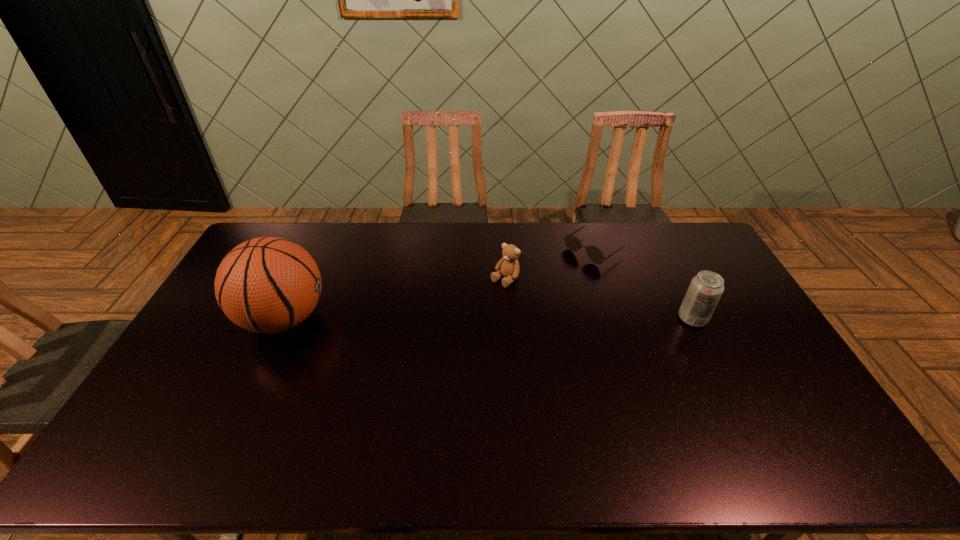
Locate an element on the screen. Image resolution: width=960 pixels, height=540 pixels. free space on the desktop that is between the tallest object and the third shortest object and is positioned on the front-facing side of the shortest object is located at coordinates (493, 319).

You are a GUI agent. You are given a task and a screenshot of the screen. Output one action in this format:
    pyautogui.click(x=<x>, y=<y>)
    Task: Click on the free space on the desktop that is between the basketball and the soda can and is positioned on the face of the teddy bear
    The width and height of the screenshot is (960, 540).
    Given the screenshot: What is the action you would take?
    pyautogui.click(x=462, y=319)